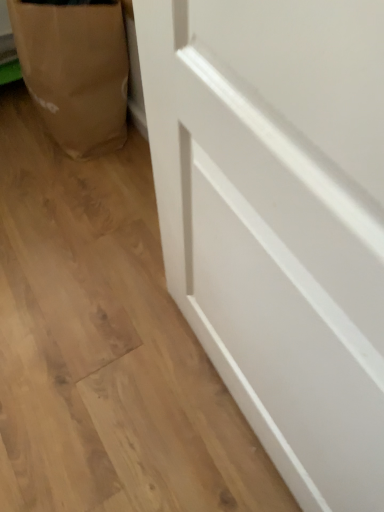
Question: Is brown paper bag at lower left facing away from white smooth door at lower right?

Choices:
 (A) yes
 (B) no

Answer: (B)

Question: Are brown paper bag at lower left and white smooth door at lower right making contact?

Choices:
 (A) no
 (B) yes

Answer: (A)

Question: Can you confirm if brown paper bag at lower left is positioned to the right of white smooth door at lower right?

Choices:
 (A) yes
 (B) no

Answer: (B)

Question: Is brown paper bag at lower left further to camera compared to white smooth door at lower right?

Choices:
 (A) no
 (B) yes

Answer: (B)

Question: From a real-world perspective, is brown paper bag at lower left on white smooth door at lower right?

Choices:
 (A) yes
 (B) no

Answer: (A)

Question: Does brown paper bag at lower left have a smaller size compared to white smooth door at lower right?

Choices:
 (A) no
 (B) yes

Answer: (A)

Question: Is the depth of white smooth door at lower right greater than that of brown paper bag at lower left?

Choices:
 (A) yes
 (B) no

Answer: (B)

Question: From the image's perspective, does white smooth door at lower right appear higher than brown paper bag at lower left?

Choices:
 (A) yes
 (B) no

Answer: (B)

Question: Is white smooth door at lower right taller than brown paper bag at lower left?

Choices:
 (A) no
 (B) yes

Answer: (A)

Question: From a real-world perspective, is white smooth door at lower right below brown paper bag at lower left?

Choices:
 (A) yes
 (B) no

Answer: (A)

Question: Is white smooth door at lower right far away from brown paper bag at lower left?

Choices:
 (A) yes
 (B) no

Answer: (B)

Question: Is white smooth door at lower right thinner than brown paper bag at lower left?

Choices:
 (A) no
 (B) yes

Answer: (A)

Question: From a real-world perspective, is brown paper bag at lower left positioned above or below white smooth door at lower right?

Choices:
 (A) below
 (B) above

Answer: (B)